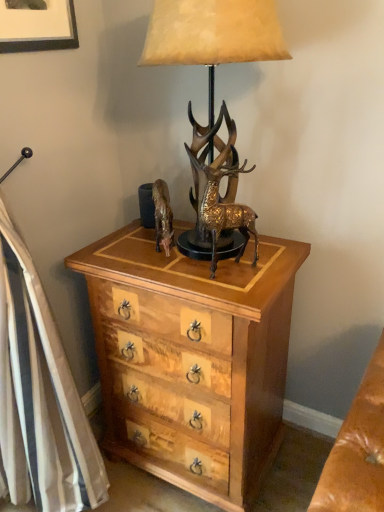
Where is `vacant space to the left of gold textured deer at center`? vacant space to the left of gold textured deer at center is located at coordinates (175, 271).